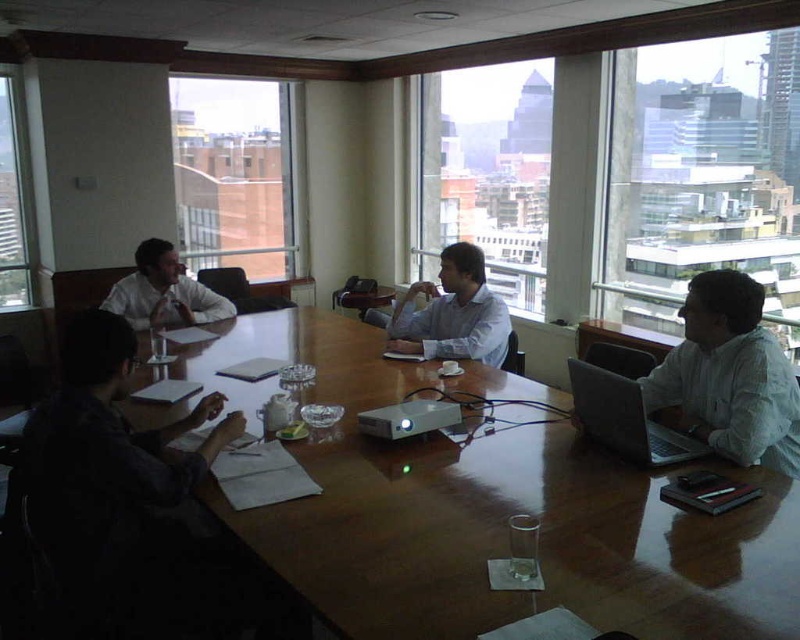
Question: Which object is the closest to the transparent glass window at center?

Choices:
 (A) brick wall at upper left
 (B) white matte shirt at right
 (C) transparent glass window at upper left

Answer: (A)

Question: Considering the relative positions of light blue shirt at center and transparent glass window at upper center in the image provided, where is light blue shirt at center located with respect to transparent glass window at upper center?

Choices:
 (A) below
 (B) above

Answer: (A)

Question: Does wooden table at center have a smaller size compared to transparent glass window at upper right?

Choices:
 (A) no
 (B) yes

Answer: (A)

Question: Estimate the real-world distances between objects in this image. Which object is closer to the light blue shirt at center?

Choices:
 (A) transparent glass window at center
 (B) brick wall at upper left

Answer: (A)

Question: Is transparent glass window at upper right behind brick wall at upper left?

Choices:
 (A) no
 (B) yes

Answer: (A)

Question: Which point is farther to the camera?

Choices:
 (A) (210, 321)
 (B) (796, 352)

Answer: (B)